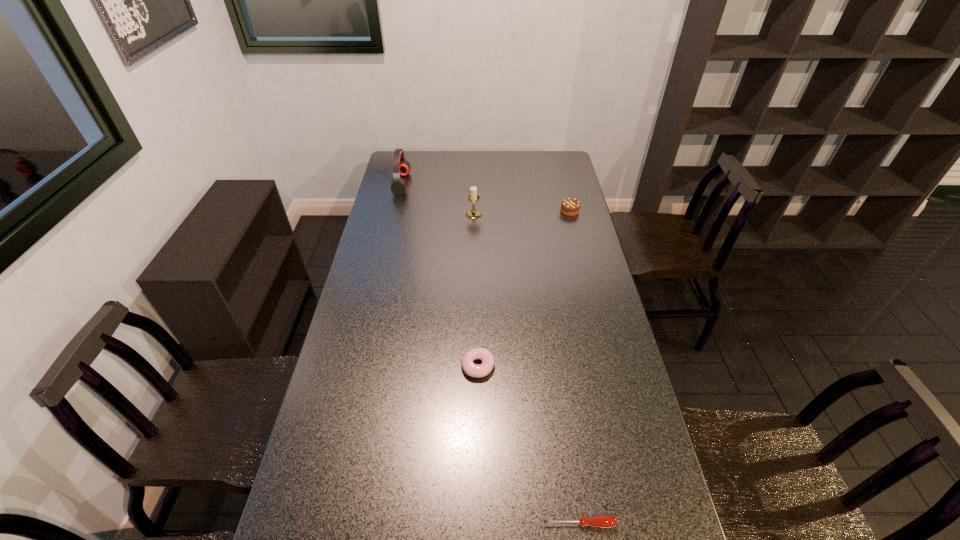
Where is `vacant space located 0.370m on the right of the candle holder`? vacant space located 0.370m on the right of the candle holder is located at coordinates (565, 214).

Locate an element on the screen. free space located on the back of the third shortest object is located at coordinates (566, 198).

Find the location of `free space located 0.300m on the left of the second nearest object`. free space located 0.300m on the left of the second nearest object is located at coordinates (365, 367).

Locate an element on the screen. This screenshot has height=540, width=960. vacant space located 0.110m on the right of the fourth object from left to right is located at coordinates (662, 523).

Locate an element on the screen. object that is positioned at the far edge is located at coordinates (401, 167).

Locate an element on the screen. This screenshot has width=960, height=540. object present at the left edge is located at coordinates (401, 167).

Image resolution: width=960 pixels, height=540 pixels. Identify the location of chocolate cake at the right edge. (569, 206).

I want to click on screwdriver positioned at the right edge, so click(604, 521).

Identify the location of object that is at the far left corner. (401, 167).

Find the location of a particular element. vacant space at the far edge of the desktop is located at coordinates (508, 157).